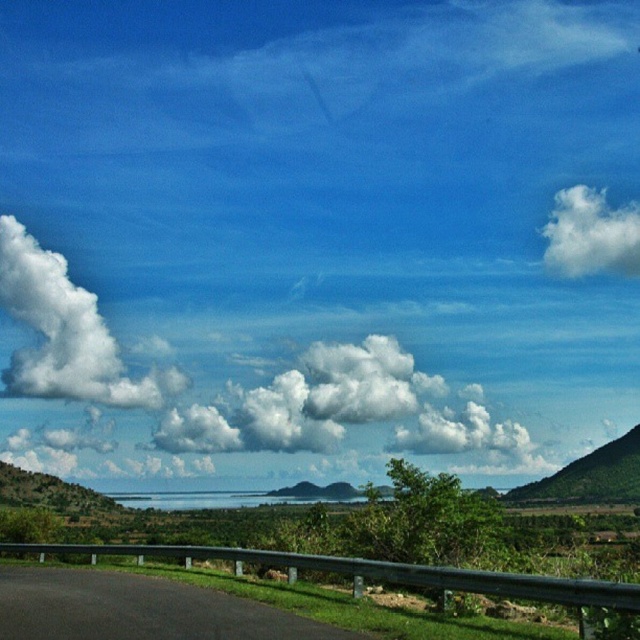
Is white fluffy cloud at upper center bigger than white fluffy cloud at upper right?

Correct, white fluffy cloud at upper center is larger in size than white fluffy cloud at upper right.

Which is in front, point (467, 432) or point (580, 240)?

Positioned in front is point (467, 432).

Where is `white fluffy cloud at upper center`? The image size is (640, 640). white fluffy cloud at upper center is located at coordinates (230, 390).

Does white fluffy cloud at upper center appear on the left side of green matte hill at right?

Yes, white fluffy cloud at upper center is to the left of green matte hill at right.

Who is more distant from viewer, [106,365] or [624,465]?

Point [106,365]

At what (x,y) coordinates should I click in order to perform the action: click on white fluffy cloud at upper center. Please return your answer as a coordinate pair (x, y). The height and width of the screenshot is (640, 640). Looking at the image, I should click on (230, 390).

Does white fluffy cloud at upper right appear on the left side of green matte hill at right?

In fact, white fluffy cloud at upper right is to the right of green matte hill at right.

At what (x,y) coordinates should I click in order to perform the action: click on white fluffy cloud at upper right. Please return your answer as a coordinate pair (x, y). Looking at the image, I should click on (589, 234).